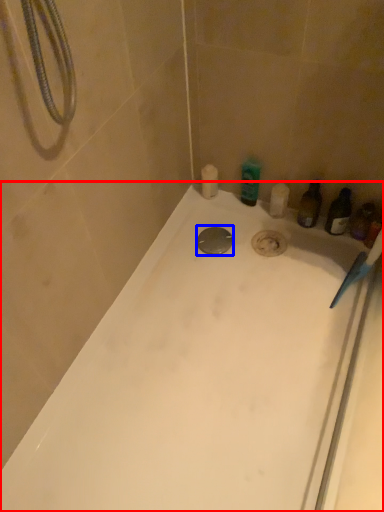
Question: Which object is closer to the camera taking this photo, bathtub (highlighted by a red box) or drain (highlighted by a blue box)?

Choices:
 (A) bathtub
 (B) drain

Answer: (A)